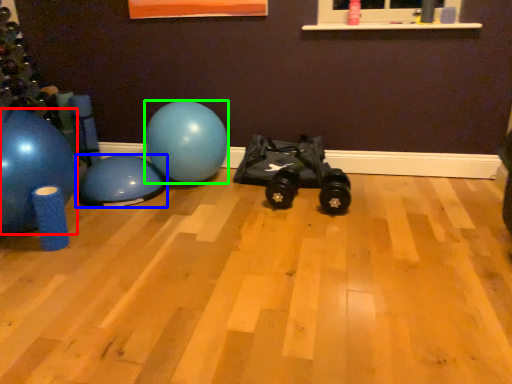
Question: Which object is the farthest from ball (highlighted by a red box)? Choose among these: ball (highlighted by a blue box) or ball (highlighted by a green box).

Choices:
 (A) ball
 (B) ball

Answer: (B)